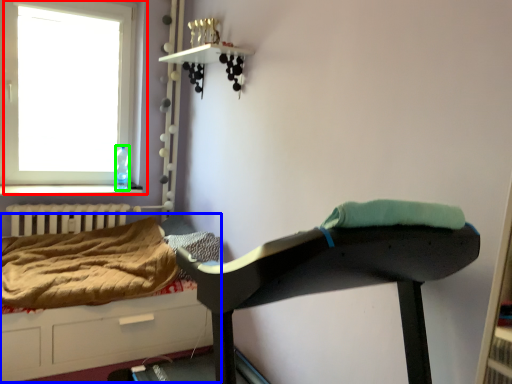
Question: Which object is positioned closest to window (highlighted by a red box)? Select from hospital bed (highlighted by a blue box) and bottle (highlighted by a green box).

Choices:
 (A) hospital bed
 (B) bottle

Answer: (B)